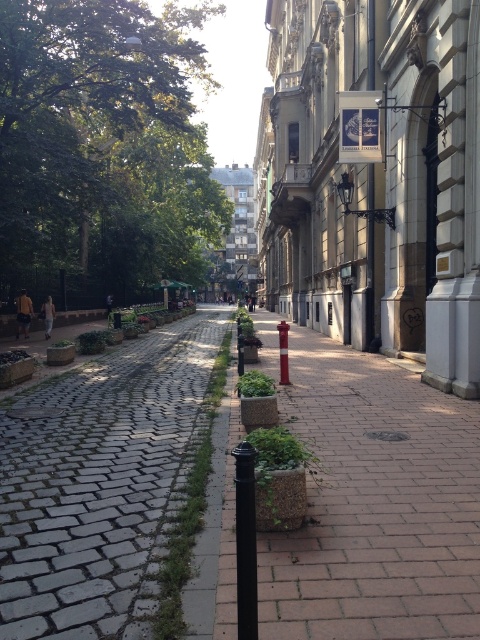
Which is behind, point (119, 356) or point (285, 337)?

Point (119, 356)

Which is more to the left, gray cobblestone pavement at left or red plastic fire hydrant at center?

Positioned to the left is gray cobblestone pavement at left.

Between point (33, 499) and point (283, 376), which one is positioned in front?

Point (33, 499)

Locate an element on the screen. The height and width of the screenshot is (640, 480). gray cobblestone pavement at left is located at coordinates (98, 483).

Is brick pavement at center shorter than black matte pole at center?

In fact, brick pavement at center may be taller than black matte pole at center.

Which is behind, point (447, 586) or point (238, 476)?

Point (447, 586)

Who is more distant from viewer, (332, 417) or (240, 584)?

The point (332, 417) is more distant.

The height and width of the screenshot is (640, 480). I want to click on brick pavement at center, so click(x=374, y=506).

Between brick pavement at center and gray cobblestone pavement at left, which one appears on the right side from the viewer's perspective?

brick pavement at center

Find the location of `brick pavement at center`. brick pavement at center is located at coordinates (374, 506).